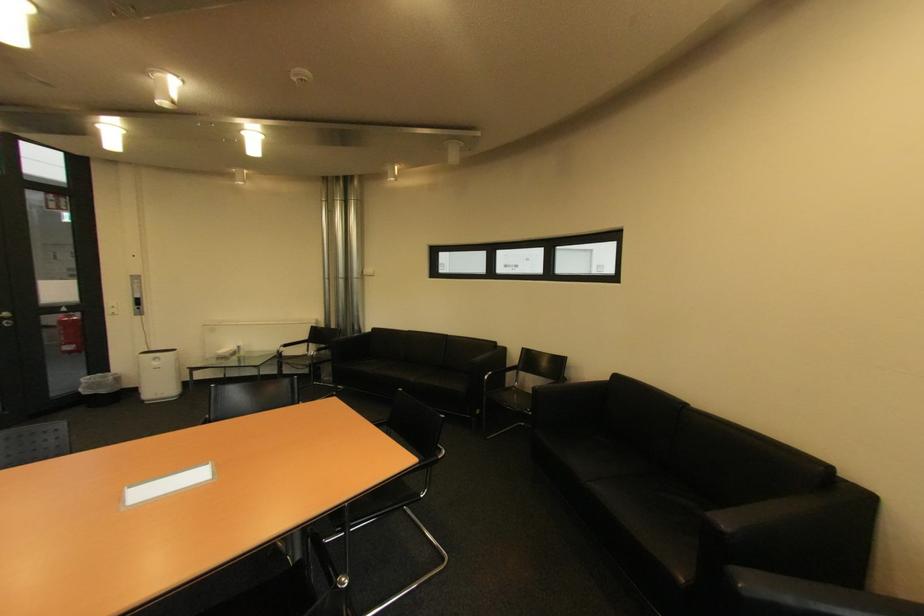
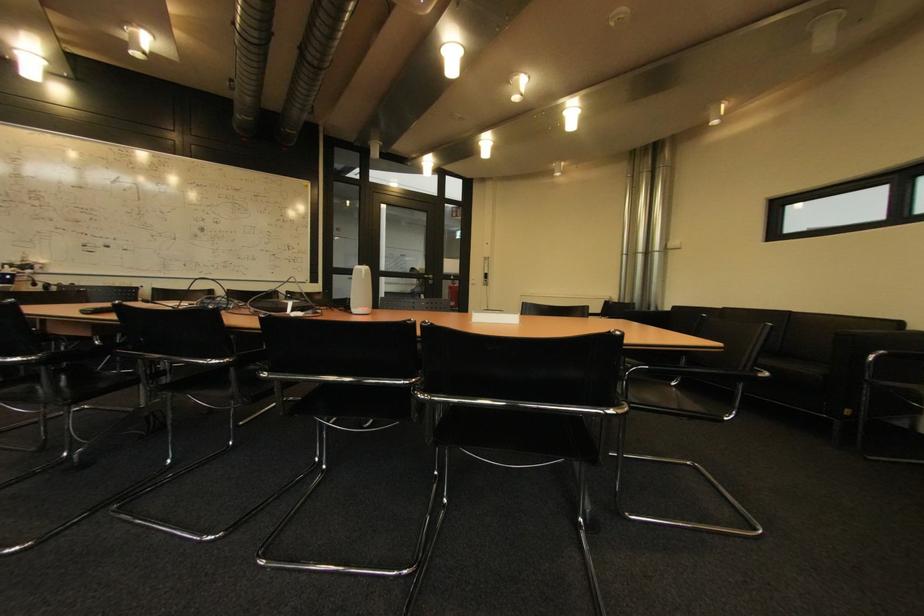
Question: The camera is either moving clockwise (left) or counter-clockwise (right) around the object. The first image is from the beginning of the video and the second image is from the end. Is the camera moving left or right when shooting the video?

Choices:
 (A) Left
 (B) Right

Answer: (B)